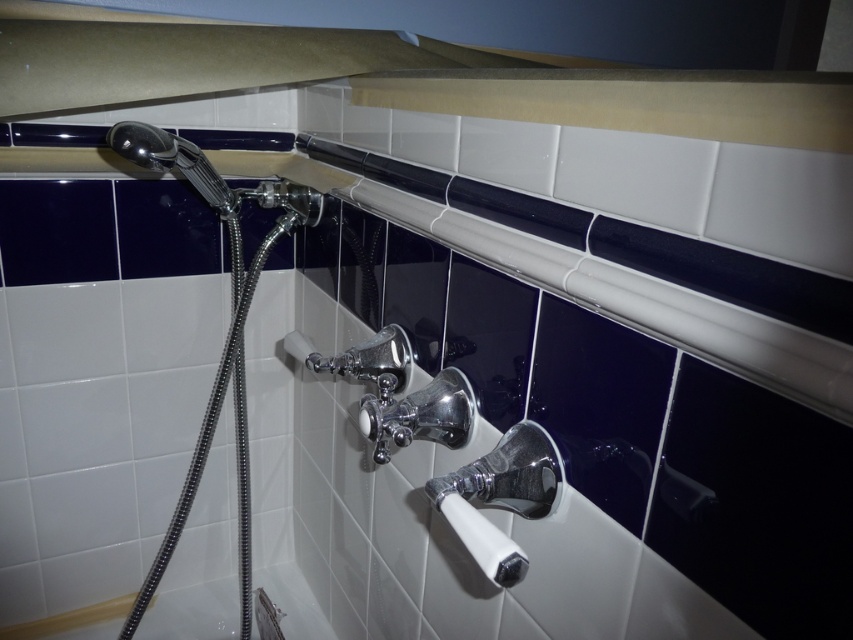
Does white glossy bath at lower left appear on the left side of shiny chrome shower head at upper left?

Correct, you'll find white glossy bath at lower left to the left of shiny chrome shower head at upper left.

Does white glossy bath at lower left have a lesser width compared to shiny chrome shower head at upper left?

Incorrect, white glossy bath at lower left's width is not less than shiny chrome shower head at upper left's.

Find the location of `white glossy bath at lower left`. white glossy bath at lower left is located at coordinates (193, 612).

The width and height of the screenshot is (853, 640). In order to click on white glossy bath at lower left in this screenshot , I will do `click(193, 612)`.